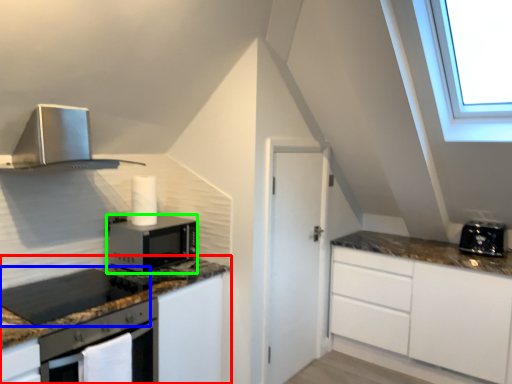
Question: Which object is the closest to the cabinetry (highlighted by a red box)? Choose among these: gas stove (highlighted by a blue box) or microwave oven (highlighted by a green box).

Choices:
 (A) gas stove
 (B) microwave oven

Answer: (A)